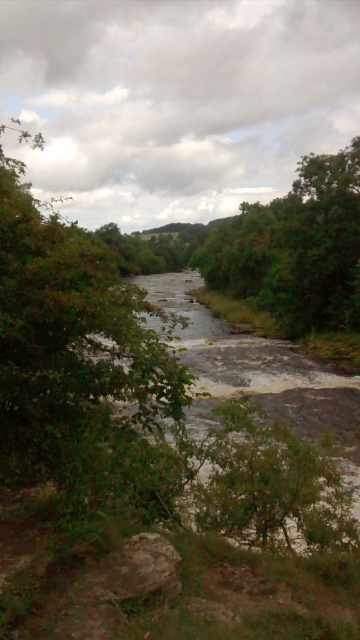
Can you confirm if rough textured stream at center is bigger than green leafy tree at center?

Incorrect, rough textured stream at center is not larger than green leafy tree at center.

Does point (267, 401) come behind point (308, 289)?

No, it is in front of (308, 289).

Identify the location of rough textured stream at center. The height and width of the screenshot is (640, 360). (250, 369).

Is green leafy tree at left to the left of green leafy tree at center from the viewer's perspective?

Indeed, green leafy tree at left is positioned on the left side of green leafy tree at center.

Is green leafy tree at left positioned at the back of green leafy tree at center?

No, green leafy tree at left is in front of green leafy tree at center.

Measure the distance between point (32, 352) and camera.

Point (32, 352) and camera are 13.33 feet apart from each other.

Locate an element on the screen. Image resolution: width=360 pixels, height=640 pixels. green leafy tree at left is located at coordinates (79, 360).

Describe the element at coordinates (79, 360) in the screenshot. This screenshot has height=640, width=360. I see `green leafy tree at left` at that location.

Is green leafy tree at left thinner than rough textured stream at center?

No.

Is point (47, 328) closer to camera compared to point (309, 376)?

Yes, it is.

Where is `green leafy tree at left`? green leafy tree at left is located at coordinates (79, 360).